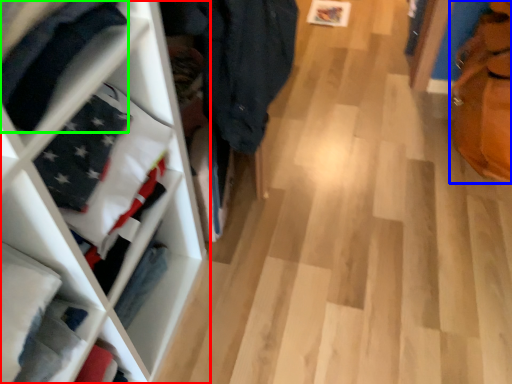
Question: Which object is the farthest from shelf (highlighted by a red box)? Choose among these: tote bag (highlighted by a blue box) or clothing (highlighted by a green box).

Choices:
 (A) tote bag
 (B) clothing

Answer: (A)